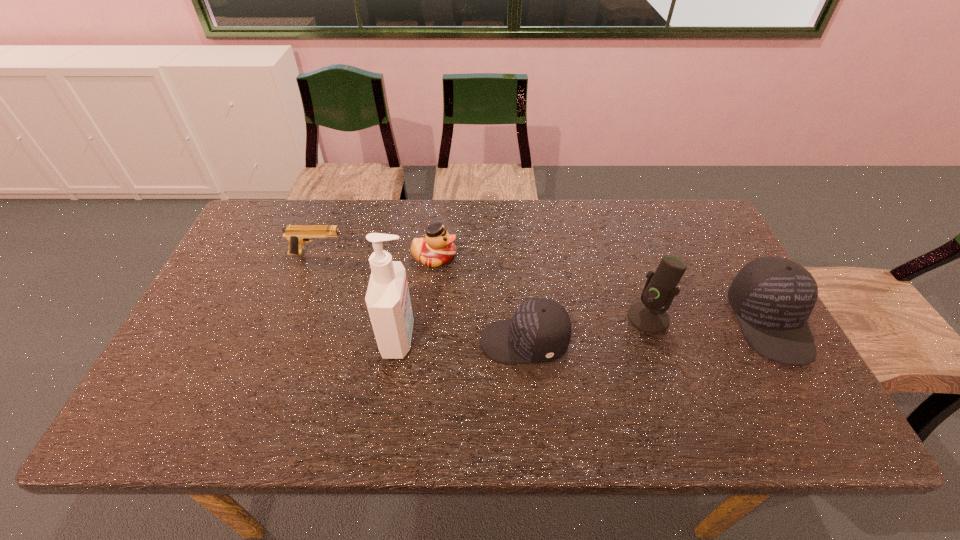
This screenshot has width=960, height=540. I want to click on unoccupied position between the left baseball cap and the cleansing agent, so click(x=462, y=340).

Identify the location of free spot between the second object from right to left and the duck. The height and width of the screenshot is (540, 960). (541, 288).

Locate an element on the screen. This screenshot has height=540, width=960. vacant space that is in between the rightmost object and the cleansing agent is located at coordinates (584, 330).

You are a GUI agent. You are given a task and a screenshot of the screen. Output one action in this format:
    pyautogui.click(x=<x>, y=<y>)
    Task: Click on the object that stands as the fourth closest to the microphone
    The width and height of the screenshot is (960, 540).
    Given the screenshot: What is the action you would take?
    pyautogui.click(x=388, y=302)

Select which object appears as the fifth closest to the cleansing agent. Please provide its 2D coordinates. Your answer should be formatted as a tuple, i.e. [(x, y)], where the tuple contains the x and y coordinates of a point satisfying the conditions above.

[(772, 297)]

You are a GUI agent. You are given a task and a screenshot of the screen. Output one action in this format:
    pyautogui.click(x=<x>, y=<y>)
    Task: Click on the free space that satisfies the following two spatial constraints: 1. on the face of the microphone; 2. on the right side of the duck
    The width and height of the screenshot is (960, 540).
    Given the screenshot: What is the action you would take?
    pyautogui.click(x=428, y=318)

Find the location of a particular element. vacant space that satisfies the following two spatial constraints: 1. at the barrel of the leftmost object; 2. on the back side of the fifth shortest object is located at coordinates click(294, 318).

Locate an element on the screen. vacant space that satisfies the following two spatial constraints: 1. at the barrel of the second object from right to left; 2. on the right side of the leftmost object is located at coordinates (294, 318).

I want to click on free space that satisfies the following two spatial constraints: 1. at the barrel of the leftmost object; 2. on the right side of the microphone, so click(294, 318).